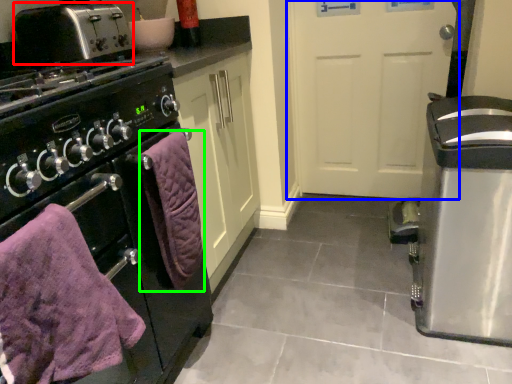
Question: Which object is positioned farthest from toaster (highlighted by a red box)? Select from door (highlighted by a blue box) and bath towel (highlighted by a green box).

Choices:
 (A) door
 (B) bath towel

Answer: (A)